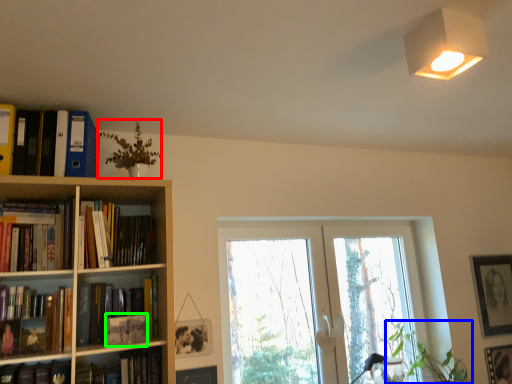
Question: Which is farther away from plant (highlighted by a red box)? plant (highlighted by a blue box) or paperback book (highlighted by a green box)?

Choices:
 (A) plant
 (B) paperback book

Answer: (A)